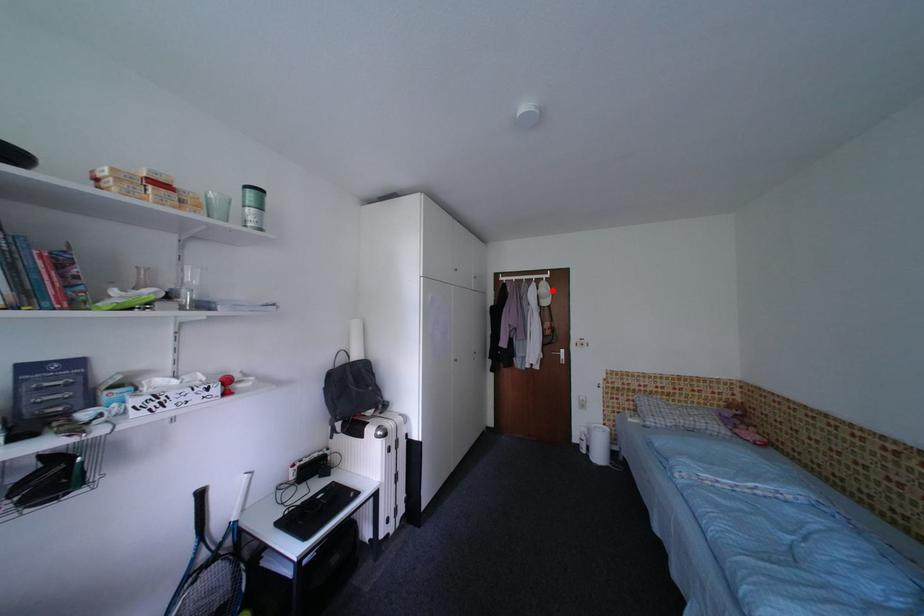
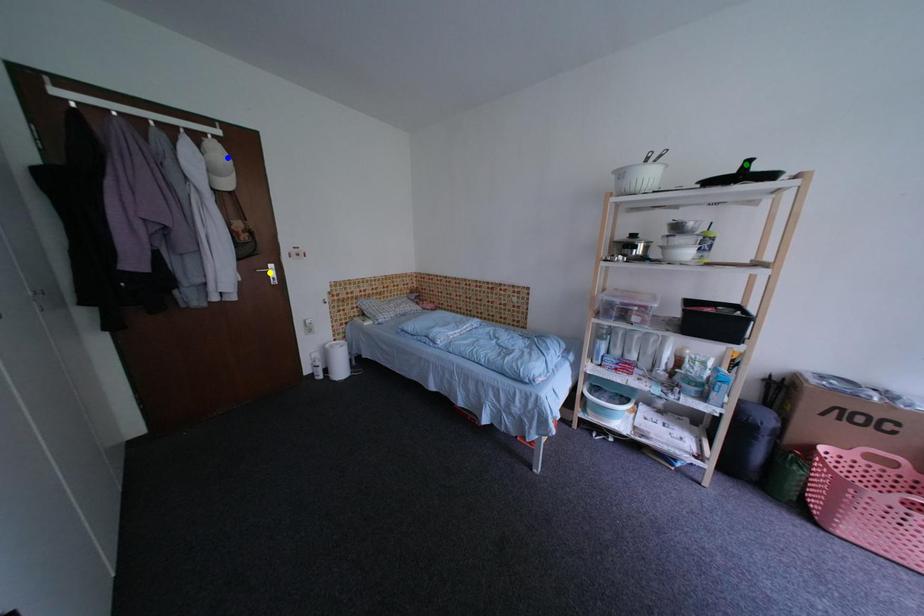
Question: I am providing you with two images of the same scene from different viewpoints. A red point is marked on the first image. You are given multiple points on the second image. Which point in image 2 is actually the same real-world point as the red point in image 1?

Choices:
 (A) yellow point
 (B) blue point
 (C) green point

Answer: (B)